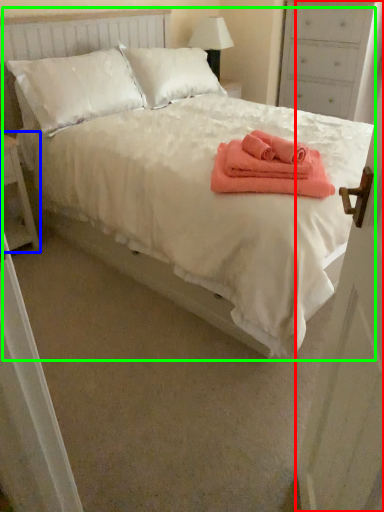
Question: Considering the real-world distances, which object is closest to door (highlighted by a red box)? nightstand (highlighted by a blue box) or bed (highlighted by a green box).

Choices:
 (A) nightstand
 (B) bed

Answer: (B)